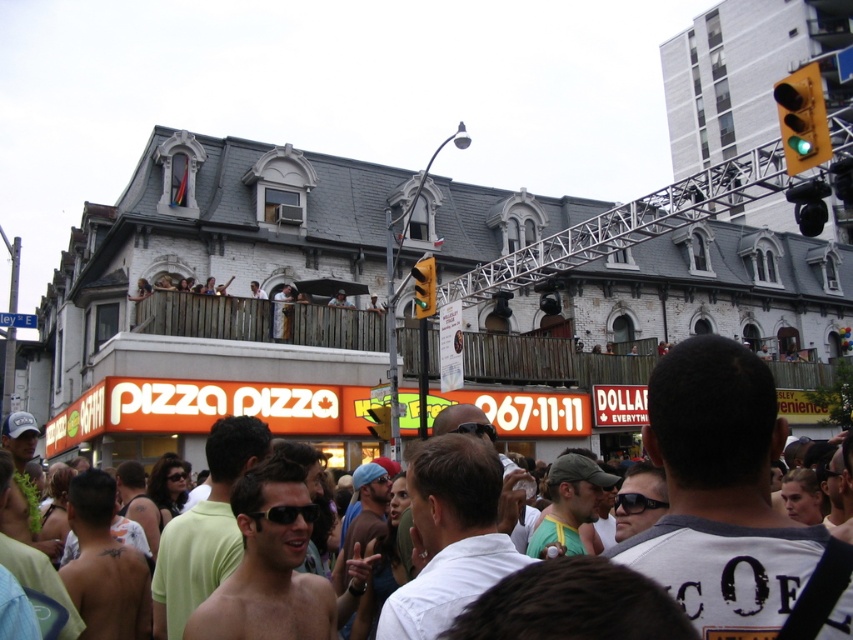
Is point (579, 467) positioned in front of point (792, 196)?

Yes.

Where is `green fabric cap at center`? The width and height of the screenshot is (853, 640). green fabric cap at center is located at coordinates coord(570,502).

Can you confirm if white cotton t-shirt at center is positioned above green matte shirt at center?

Indeed, white cotton t-shirt at center is positioned over green matte shirt at center.

Measure the distance between white cotton t-shirt at center and camera.

white cotton t-shirt at center and camera are 21.89 meters apart from each other.

What are the coordinates of `white cotton t-shirt at center` in the screenshot? It's located at (720, 493).

Based on the photo, does yellow plastic traffic light at upper center appear under light brown wooden railing at upper center?

Indeed, yellow plastic traffic light at upper center is positioned under light brown wooden railing at upper center.

Is point (384, 420) farther from camera compared to point (349, 301)?

No.

What do you see at coordinates (380, 420) in the screenshot? The height and width of the screenshot is (640, 853). I see `yellow plastic traffic light at upper center` at bounding box center [380, 420].

Identify the location of yellow plastic traffic light at upper center. This screenshot has width=853, height=640. (380, 420).